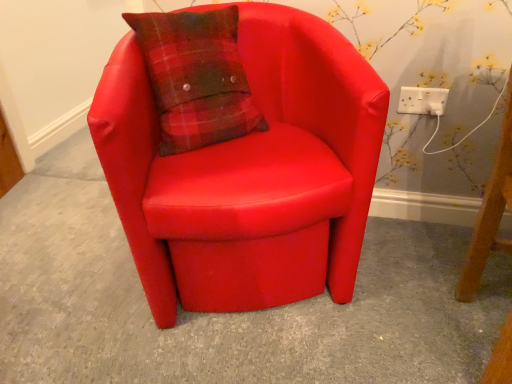
Find the location of a particular element. The height and width of the screenshot is (384, 512). matte red armchair at center is located at coordinates (249, 173).

Describe the element at coordinates (249, 173) in the screenshot. The height and width of the screenshot is (384, 512). I see `matte red armchair at center` at that location.

What do you see at coordinates (422, 100) in the screenshot? The image size is (512, 384). I see `white plastic socket at upper right` at bounding box center [422, 100].

What is the approximate width of white plastic socket at upper right?

The width of white plastic socket at upper right is 2.13 centimeters.

Identify the location of white plastic socket at upper right. (422, 100).

What are the coordinates of `matte red armchair at center` in the screenshot? It's located at (249, 173).

Is matte red armchair at center at the right side of white plastic socket at upper right?

No.

In the image, is matte red armchair at center positioned in front of or behind white plastic socket at upper right?

matte red armchair at center is positioned closer to the viewer than white plastic socket at upper right.

Which is nearer, (152, 101) or (421, 89)?

Point (152, 101).

Looking at this image, from the image's perspective, which one is positioned higher, matte red armchair at center or white plastic socket at upper right?

white plastic socket at upper right.

From a real-world perspective, is matte red armchair at center physically located above or below white plastic socket at upper right?

matte red armchair at center is below white plastic socket at upper right.

Looking at their sizes, would you say matte red armchair at center is wider or thinner than white plastic socket at upper right?

matte red armchair at center is wider than white plastic socket at upper right.

Which of these two, matte red armchair at center or white plastic socket at upper right, stands shorter?

white plastic socket at upper right is shorter.

From the picture: Considering the relative sizes of matte red armchair at center and white plastic socket at upper right in the image provided, is matte red armchair at center bigger than white plastic socket at upper right?

Yes, matte red armchair at center is bigger than white plastic socket at upper right.

Would you say matte red armchair at center is outside white plastic socket at upper right?

That's correct, matte red armchair at center is outside of white plastic socket at upper right.

Is matte red armchair at center far from white plastic socket at upper right?

No.

Is matte red armchair at center facing away from white plastic socket at upper right?

matte red armchair at center does not have its back to white plastic socket at upper right.

Can you tell me how much matte red armchair at center and white plastic socket at upper right differ in facing direction?

The facing directions of matte red armchair at center and white plastic socket at upper right are 21.1 degrees apart.

The width and height of the screenshot is (512, 384). I want to click on electric outlet that is on the right side of matte red armchair at center, so click(x=422, y=100).

Visually, is white plastic socket at upper right positioned to the left or to the right of matte red armchair at center?

white plastic socket at upper right is to the right of matte red armchair at center.

Who is more distant, white plastic socket at upper right or matte red armchair at center?

white plastic socket at upper right is further away from the camera.

Does point (420, 88) lie behind point (112, 106)?

Yes.

From the image's perspective, is white plastic socket at upper right above or below matte red armchair at center?

Clearly, from the image's perspective, white plastic socket at upper right is above matte red armchair at center.

From a real-world perspective, between white plastic socket at upper right and matte red armchair at center, who is vertically lower?

From a 3D spatial view, matte red armchair at center is below.

Which object is thinner, white plastic socket at upper right or matte red armchair at center?

white plastic socket at upper right.

Can you confirm if white plastic socket at upper right is taller than matte red armchair at center?

Incorrect, the height of white plastic socket at upper right is not larger of that of matte red armchair at center.

Considering the sizes of objects white plastic socket at upper right and matte red armchair at center in the image provided, who is bigger, white plastic socket at upper right or matte red armchair at center?

Bigger between the two is matte red armchair at center.

Could matte red armchair at center be considered to be inside white plastic socket at upper right?

No, matte red armchair at center is not surrounded by white plastic socket at upper right.

Consider the image. Would you consider white plastic socket at upper right to be distant from matte red armchair at center?

white plastic socket at upper right is actually quite close to matte red armchair at center.

Is white plastic socket at upper right facing away from matte red armchair at center?

No, white plastic socket at upper right's orientation is not away from matte red armchair at center.

Locate an element on the screen. chair below the white plastic socket at upper right (from the image's perspective) is located at coordinates (249, 173).

Identify the location of chair located in front of the white plastic socket at upper right. Image resolution: width=512 pixels, height=384 pixels. (249, 173).

Where is `electric outlet lying above the matte red armchair at center (from the image's perspective)`? The width and height of the screenshot is (512, 384). electric outlet lying above the matte red armchair at center (from the image's perspective) is located at coordinates (422, 100).